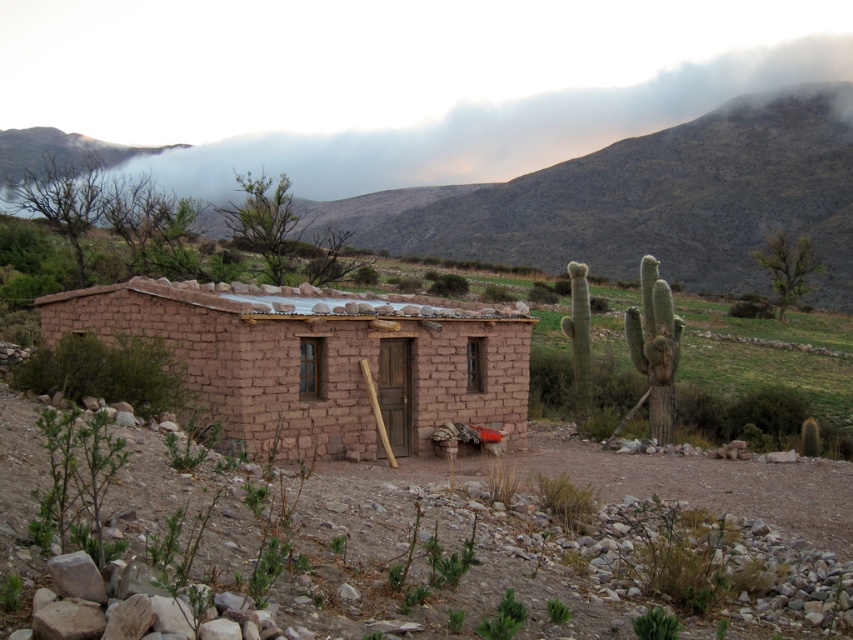
Is point (438, 321) positioned after point (53, 136)?

That is False.

Who is more forward, (195, 292) or (61, 152)?

Point (195, 292) is more forward.

Locate an element on the screen. The image size is (853, 640). brown adobe hut at center is located at coordinates (316, 364).